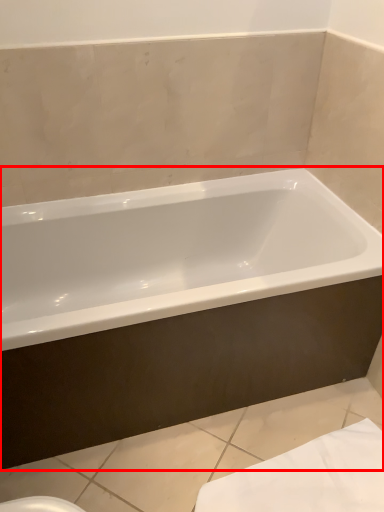
Question: From the image's perspective, considering the relative positions of bathtub (annotated by the red box) and bath towel in the image provided, where is bathtub (annotated by the red box) located with respect to the staircase?

Choices:
 (A) above
 (B) below

Answer: (A)